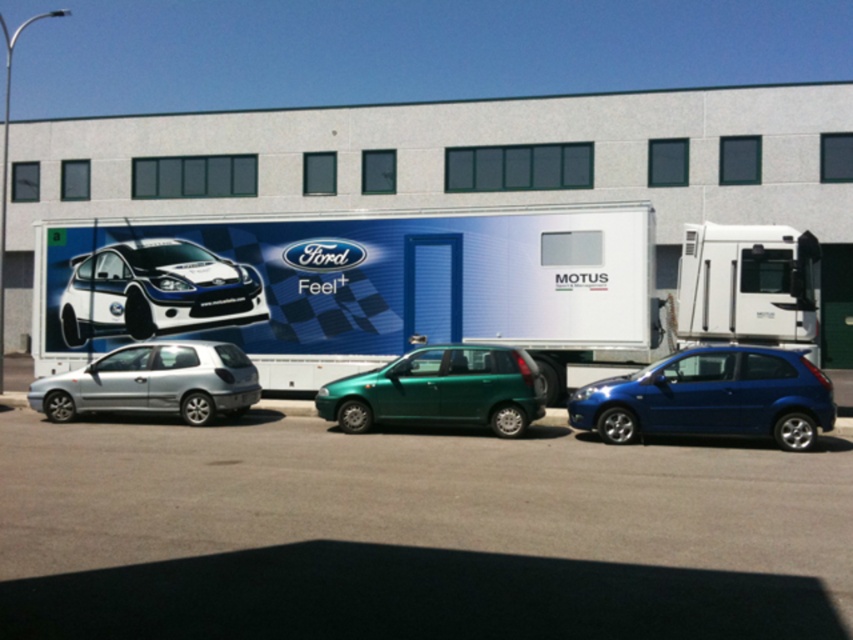
You are a delivery person who needs to park your delivery van behind the white glossy truck at center. The parking space behind the truck can only accommodate vehicles smaller than the truck. Can you park your van there if your van is the same size as the metallic green hatchback at center?

The white glossy truck at center is larger than the metallic green hatchback at center. Since your van is the same size as the metallic green hatchback at center, it is smaller than the truck, so you can park your van in the parking space behind the truck.

You are a delivery driver who needs to park your truck between the white glossy rally car at left and the metallic green hatchback at center. Based on the scene, can you safely park there without blocking the rally car?

The white glossy rally car at left is further to the viewer than the metallic green hatchback at center, so parking between them would place the truck closer to the rally car. This might block its access, so it is not advisable to park there.